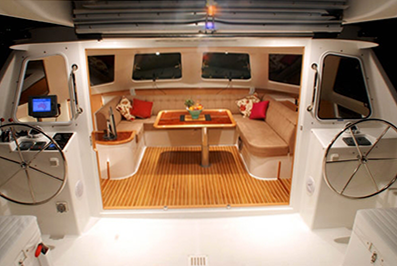
The image size is (397, 266). I want to click on handles, so click(x=75, y=89), click(x=314, y=95).